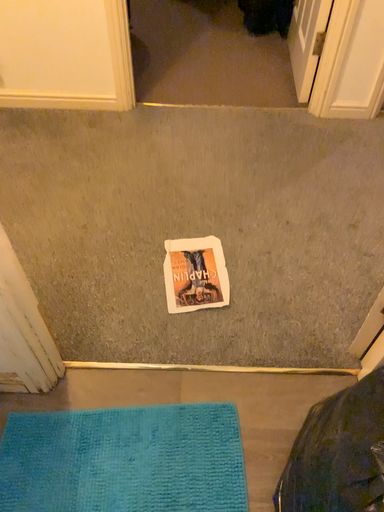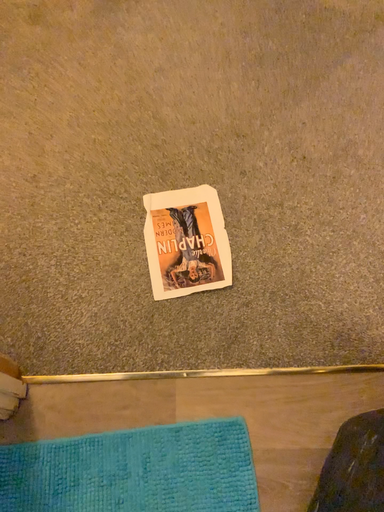
Question: Which way did the camera rotate in the video?

Choices:
 (A) rotated upward
 (B) rotated downward

Answer: (B)